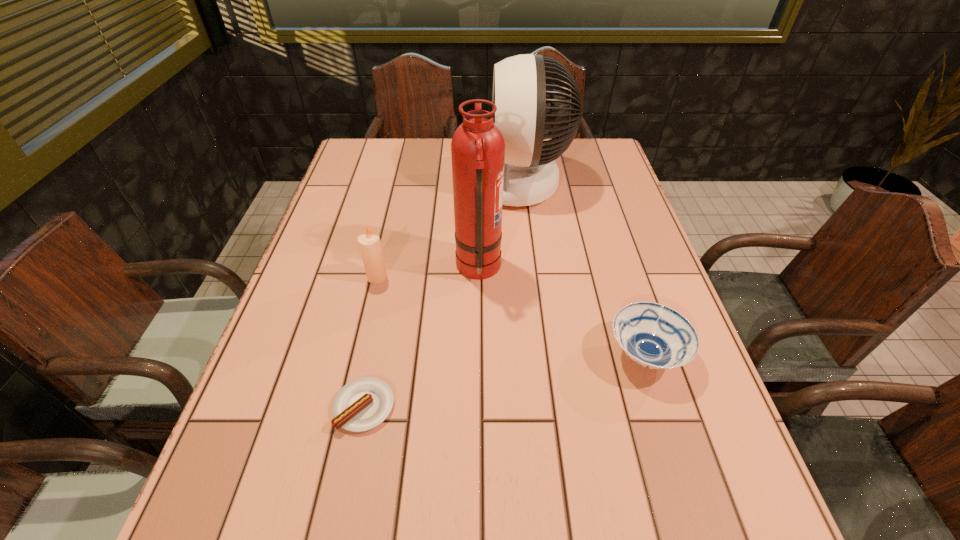
Find the location of a particular element. Image resolution: width=960 pixels, height=540 pixels. fire extinguisher is located at coordinates tap(478, 148).

This screenshot has width=960, height=540. Find the location of `fan`. fan is located at coordinates (525, 112).

Identify the location of candle. Image resolution: width=960 pixels, height=540 pixels. (370, 247).

This screenshot has height=540, width=960. Identify the location of soup bowl. (655, 336).

Where is `the shortest object`? This screenshot has width=960, height=540. the shortest object is located at coordinates (364, 403).

The height and width of the screenshot is (540, 960). Find the location of `vacant space located 0.080m on the label side of the fire extinguisher`. vacant space located 0.080m on the label side of the fire extinguisher is located at coordinates (534, 268).

Find the location of a particular element. The width and height of the screenshot is (960, 540). vacant space located on the grille of the farthest object is located at coordinates (425, 184).

Where is `vacant area located on the grille of the farthest object`? vacant area located on the grille of the farthest object is located at coordinates (455, 184).

Where is `free spot located 0.310m on the grille of the farthest object`? free spot located 0.310m on the grille of the farthest object is located at coordinates (370, 184).

You are a GUI agent. You are given a task and a screenshot of the screen. Output one action in this format:
    pyautogui.click(x=<x>, y=<y>)
    Task: Click on the vacant region located on the back of the third tallest object
    The width and height of the screenshot is (960, 540).
    Given the screenshot: What is the action you would take?
    pyautogui.click(x=390, y=222)